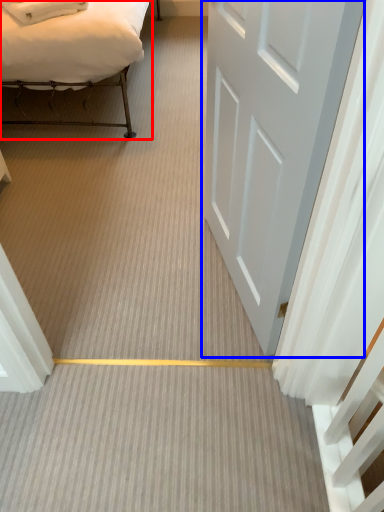
Question: Which object appears closest to the camera in this image, bed (highlighted by a red box) or door (highlighted by a blue box)?

Choices:
 (A) bed
 (B) door

Answer: (B)